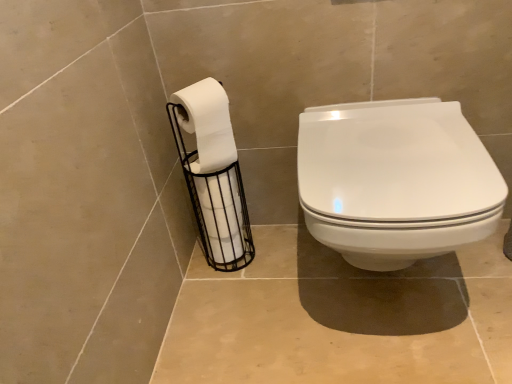
Find the location of a particular element. white glossy toilet seat at center is located at coordinates (395, 181).

Can you tell me how much white matte toilet paper at left, which appears as the 1th toilet paper when viewed from the top, and white matte toilet paper at left, the 1th toilet paper when ordered from bottom to top, differ in facing direction?

The angle between the facing direction of white matte toilet paper at left, which appears as the 1th toilet paper when viewed from the top, and the facing direction of white matte toilet paper at left, the 1th toilet paper when ordered from bottom to top, is 0.522 degrees.

Is white matte toilet paper at left, which appears as the 1th toilet paper when viewed from the top, thinner than white matte toilet paper at left, marked as the 2th toilet paper in a top-to-bottom arrangement?

Correct, the width of white matte toilet paper at left, which appears as the 1th toilet paper when viewed from the top, is less than that of white matte toilet paper at left, marked as the 2th toilet paper in a top-to-bottom arrangement.

Is white matte toilet paper at left, which ranks as the second toilet paper in bottom-to-top order, to the right of white matte toilet paper at left, the 1th toilet paper when ordered from bottom to top, from the viewer's perspective?

No, white matte toilet paper at left, which ranks as the second toilet paper in bottom-to-top order, is not to the right of white matte toilet paper at left, the 1th toilet paper when ordered from bottom to top.

From the image's perspective, is white glossy toilet seat at center above or below white matte toilet paper at left, which ranks as the second toilet paper in bottom-to-top order?

From the image's perspective, white glossy toilet seat at center appears below white matte toilet paper at left, which ranks as the second toilet paper in bottom-to-top order.

Does white glossy toilet seat at center turn towards white matte toilet paper at left, which ranks as the second toilet paper in bottom-to-top order?

No, white glossy toilet seat at center is not turned towards white matte toilet paper at left, which ranks as the second toilet paper in bottom-to-top order.

Can you see white glossy toilet seat at center touching white matte toilet paper at left, which appears as the 1th toilet paper when viewed from the top?

There is a gap between white glossy toilet seat at center and white matte toilet paper at left, which appears as the 1th toilet paper when viewed from the top.

From a real-world perspective, is white glossy toilet seat at center positioned above or below white matte toilet paper at left, which appears as the 1th toilet paper when viewed from the top?

white glossy toilet seat at center is below white matte toilet paper at left, which appears as the 1th toilet paper when viewed from the top.

Considering the relative positions of white glossy toilet seat at center and white matte toilet paper at left, marked as the 2th toilet paper in a top-to-bottom arrangement, in the image provided, is white glossy toilet seat at center to the left or to the right of white matte toilet paper at left, marked as the 2th toilet paper in a top-to-bottom arrangement,?

Clearly, white glossy toilet seat at center is on the right of white matte toilet paper at left, marked as the 2th toilet paper in a top-to-bottom arrangement, in the image.

In the image, there is a white glossy toilet seat at center. Where is `toilet paper below it (from the image's perspective)`? toilet paper below it (from the image's perspective) is located at coordinates (213, 173).

From the picture: Is white glossy toilet seat at center oriented away from white matte toilet paper at left, the 1th toilet paper when ordered from bottom to top?

No, white matte toilet paper at left, the 1th toilet paper when ordered from bottom to top, is not at the back of white glossy toilet seat at center.

Looking at this image, are white glossy toilet seat at center and white matte toilet paper at left, marked as the 2th toilet paper in a top-to-bottom arrangement, located far from each other?

No, white glossy toilet seat at center is in close proximity to white matte toilet paper at left, marked as the 2th toilet paper in a top-to-bottom arrangement.

From the image's perspective, is white matte toilet paper at left, the 1th toilet paper when ordered from bottom to top, above white glossy toilet seat at center?

No, from the image's perspective, white matte toilet paper at left, the 1th toilet paper when ordered from bottom to top, is not over white glossy toilet seat at center.

Which of these two, white matte toilet paper at left, marked as the 2th toilet paper in a top-to-bottom arrangement, or white glossy toilet seat at center, stands shorter?

white glossy toilet seat at center is shorter.

The width and height of the screenshot is (512, 384). Identify the location of toilet paper that is under the white glossy toilet seat at center (from a real-world perspective). (213, 173).

Consider the image. Is white matte toilet paper at left, the 1th toilet paper when ordered from bottom to top, positioned with its back to white glossy toilet seat at center?

No, white glossy toilet seat at center is not at the back of white matte toilet paper at left, the 1th toilet paper when ordered from bottom to top.

Is white matte toilet paper at left, which ranks as the second toilet paper in bottom-to-top order, thinner than white glossy toilet seat at center?

Correct, the width of white matte toilet paper at left, which ranks as the second toilet paper in bottom-to-top order, is less than that of white glossy toilet seat at center.

Is point (197, 117) positioned after point (374, 259)?

That is True.

Is white matte toilet paper at left, which appears as the 1th toilet paper when viewed from the top, not inside white glossy toilet seat at center?

Yes.

Considering the relative positions of white matte toilet paper at left, marked as the 2th toilet paper in a top-to-bottom arrangement, and white matte toilet paper at left, which ranks as the second toilet paper in bottom-to-top order, in the image provided, is white matte toilet paper at left, marked as the 2th toilet paper in a top-to-bottom arrangement, to the right of white matte toilet paper at left, which ranks as the second toilet paper in bottom-to-top order, from the viewer's perspective?

Yes.

Which object is further away from the camera taking this photo, white matte toilet paper at left, marked as the 2th toilet paper in a top-to-bottom arrangement, or white matte toilet paper at left, which appears as the 1th toilet paper when viewed from the top?

Positioned behind is white matte toilet paper at left, marked as the 2th toilet paper in a top-to-bottom arrangement.

Is white matte toilet paper at left, marked as the 2th toilet paper in a top-to-bottom arrangement, inside the boundaries of white matte toilet paper at left, which ranks as the second toilet paper in bottom-to-top order, or outside?

white matte toilet paper at left, marked as the 2th toilet paper in a top-to-bottom arrangement, is spatially situated outside white matte toilet paper at left, which ranks as the second toilet paper in bottom-to-top order.

At what (x,y) coordinates should I click in order to perform the action: click on toilet paper below the white matte toilet paper at left, which ranks as the second toilet paper in bottom-to-top order (from the image's perspective). Please return your answer as a coordinate pair (x, y). The image size is (512, 384). Looking at the image, I should click on (213, 173).

From the white glossy toilet seat at center, count 1st toilet papers backward and point to it. Please provide its 2D coordinates.

[(207, 124)]

Which object lies nearer to the anchor point white matte toilet paper at left, which appears as the 1th toilet paper when viewed from the top, white glossy toilet seat at center or white matte toilet paper at left, marked as the 2th toilet paper in a top-to-bottom arrangement?

Among the two, white matte toilet paper at left, marked as the 2th toilet paper in a top-to-bottom arrangement, is located nearer to white matte toilet paper at left, which appears as the 1th toilet paper when viewed from the top.

Based on their spatial positions, is white matte toilet paper at left, the 1th toilet paper when ordered from bottom to top, or white glossy toilet seat at center closer to white matte toilet paper at left, which ranks as the second toilet paper in bottom-to-top order?

Among the two, white matte toilet paper at left, the 1th toilet paper when ordered from bottom to top, is located nearer to white matte toilet paper at left, which ranks as the second toilet paper in bottom-to-top order.

From the image, which object appears to be nearer to white glossy toilet seat at center, white matte toilet paper at left, the 1th toilet paper when ordered from bottom to top, or white matte toilet paper at left, which ranks as the second toilet paper in bottom-to-top order?

white matte toilet paper at left, which ranks as the second toilet paper in bottom-to-top order, is closer to white glossy toilet seat at center.

Looking at the image, which one is located closer to white glossy toilet seat at center, white matte toilet paper at left, which ranks as the second toilet paper in bottom-to-top order, or white matte toilet paper at left, the 1th toilet paper when ordered from bottom to top?

white matte toilet paper at left, which ranks as the second toilet paper in bottom-to-top order, lies closer to white glossy toilet seat at center than the other object.

Looking at the image, which one is located further to white matte toilet paper at left, the 1th toilet paper when ordered from bottom to top, white matte toilet paper at left, which ranks as the second toilet paper in bottom-to-top order, or white glossy toilet seat at center?

white glossy toilet seat at center is further to white matte toilet paper at left, the 1th toilet paper when ordered from bottom to top.

Considering their positions, is white glossy toilet seat at center positioned closer to white matte toilet paper at left, marked as the 2th toilet paper in a top-to-bottom arrangement, than white matte toilet paper at left, which appears as the 1th toilet paper when viewed from the top?

Among the two, white matte toilet paper at left, which appears as the 1th toilet paper when viewed from the top, is located nearer to white matte toilet paper at left, marked as the 2th toilet paper in a top-to-bottom arrangement.

Identify the location of toilet paper between white matte toilet paper at left, which appears as the 1th toilet paper when viewed from the top, and white glossy toilet seat at center from left to right. (213, 173).